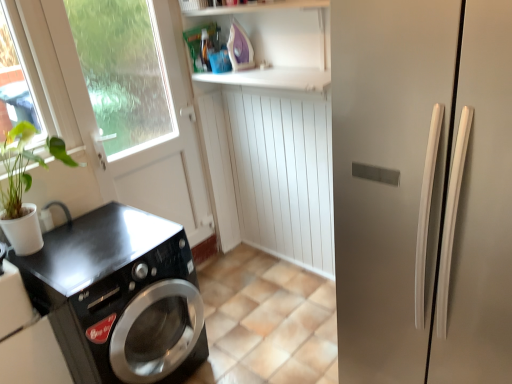
Question: Is satin silver refrigerator at right inside or outside of black glossy washing machine at lower left?

Choices:
 (A) outside
 (B) inside

Answer: (A)

Question: Is point (352, 69) closer or farther from the camera than point (185, 324)?

Choices:
 (A) farther
 (B) closer

Answer: (B)

Question: Which is farther from the black glossy washing machine at lower left?

Choices:
 (A) purple plastic iron at upper center
 (B) black glossy washing machine at lower left
 (C) satin silver refrigerator at right
 (D) black glossy screen door at left

Answer: (A)

Question: Estimate the real-world distances between objects in this image. Which object is closer to the black glossy washing machine at lower left?

Choices:
 (A) black glossy washing machine at lower left
 (B) purple plastic iron at upper center
 (C) satin silver refrigerator at right
 (D) black glossy screen door at left

Answer: (A)